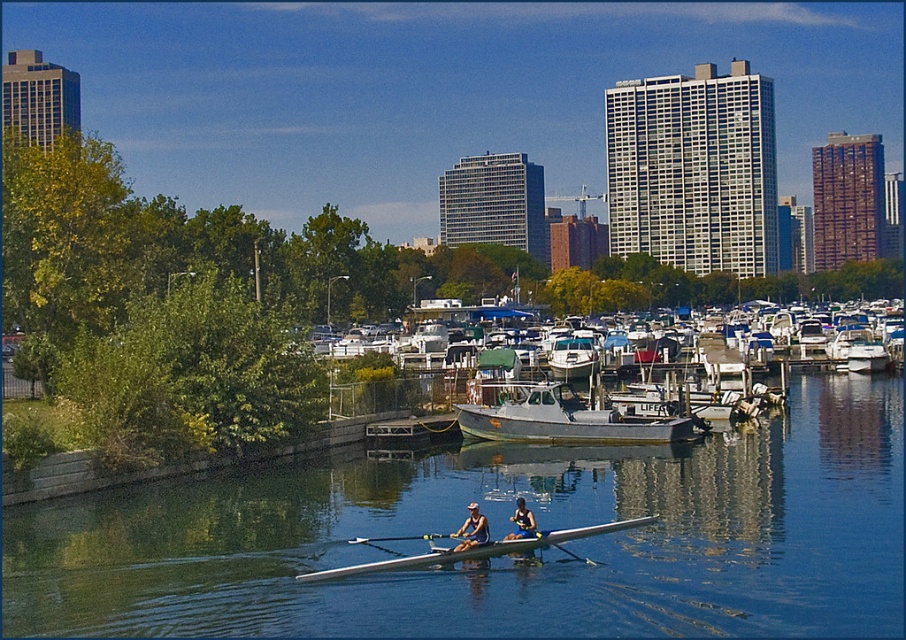
Question: Observing the image, what is the correct spatial positioning of clear blue water at center in reference to blue fabric rowing boat at center?

Choices:
 (A) right
 (B) left

Answer: (A)

Question: Which of the following is the closest to the observer?

Choices:
 (A) (x=477, y=529)
 (B) (x=323, y=577)

Answer: (B)

Question: Which point is farther from the camera taking this photo?

Choices:
 (A) (531, 532)
 (B) (374, 572)
 (C) (243, 632)

Answer: (A)

Question: Can you confirm if blue fabric rowing boat at center is smaller than matte blue rower at center?

Choices:
 (A) yes
 (B) no

Answer: (B)

Question: From the image, what is the correct spatial relationship of matte blue rower at center in relation to blue fabric rower at center?

Choices:
 (A) left
 (B) right

Answer: (A)

Question: Which object is the farthest from the clear blue water at center?

Choices:
 (A) smooth white paddle at center
 (B) white plastic paddle at center

Answer: (B)